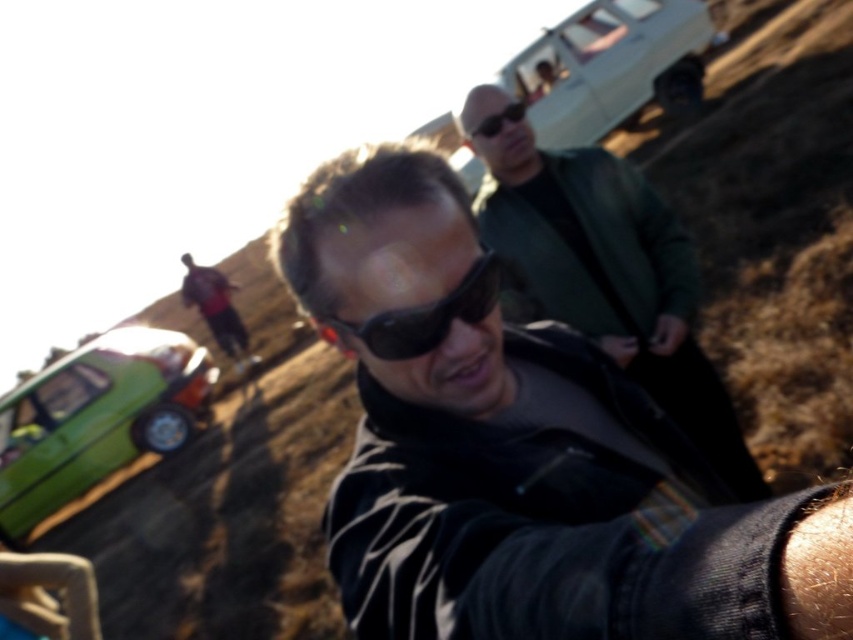
You are a photographer trying to capture a group photo of the two people near the vehicles. The black matte sunglasses at center and red shirt at center are the main subjects. Given the distance between them, will you need to use a telephoto lens to ensure both are in focus and clearly visible?

The distance between the black matte sunglasses at center and red shirt at center is 36.22 feet. A telephoto lens can help compress the scene and keep both subjects in focus at that distance, so yes, using a telephoto lens would be advisable to ensure clarity and visibility.

From the picture: You are standing at the point marked as point (96,419) in the image. Which object is directly in front of you?

The green matte car at lower left is located at point (96,419), so the object directly in front of you is the green matte car at lower left.